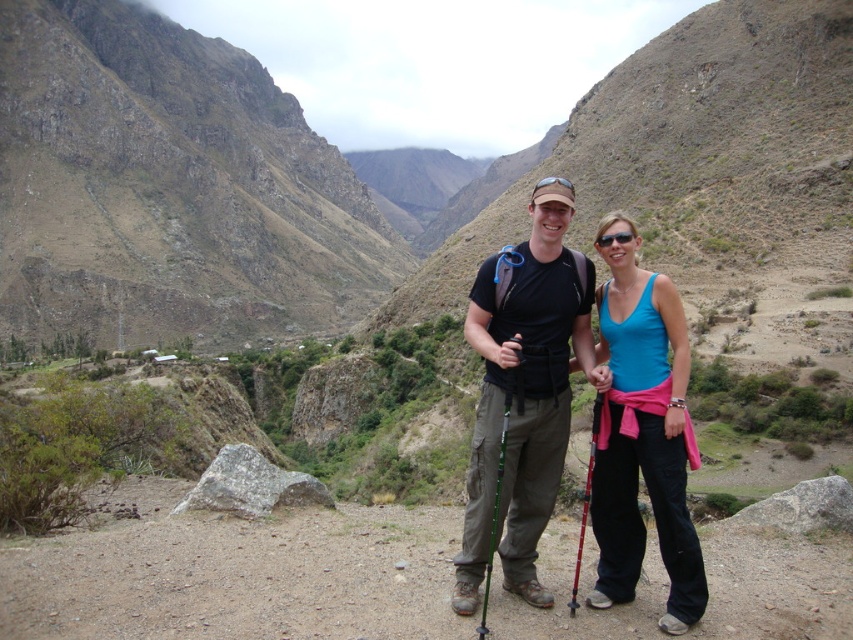
You are a hiker planning to set up a tent between the two points, point (488, 541) and point (590, 438). Which point is closer to you where you should place the tent entrance facing forward?

Point (488, 541) is closer to the viewer than point (590, 438), so you should place the tent entrance facing forward towards point (488, 541).

You are a hiker planning to carry both the matte black backpack at center and the green textured pole at center. Given that the backpack is wider than the pole, how should you position them to ensure stability while hiking on uneven terrain?

Since the matte black backpack at center is wider than the green textured pole at center, you should place the matte black backpack at center on your back and secure the green textured pole at center in a side compartment or strap to maintain balance and prevent shifting on uneven terrain.

You are a hiker planning to place a lightweight tent on the dirt path where the matte black backpack at center is located. Considering the backpack is at point 0.616, 0.615, can you confirm if this position is suitable for setting up the tent?

The matte black backpack at center is located at point (524, 394), so yes, this position on the dirt path is suitable for setting up the tent as it is a central and stable location.